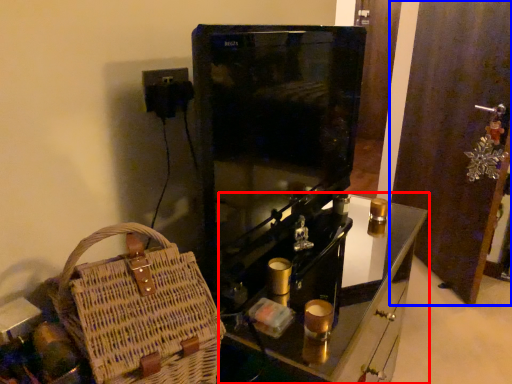
Question: Among these objects, which one is nearest to the camera, furniture (highlighted by a red box) or door (highlighted by a blue box)?

Choices:
 (A) furniture
 (B) door

Answer: (A)